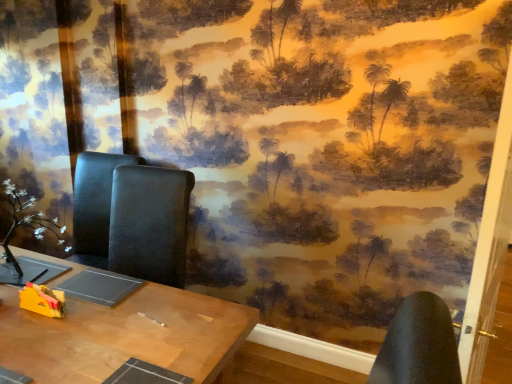
Question: From a real-world perspective, relative to white matte flower at left, is yellow plastic toy at lower left vertically above or below?

Choices:
 (A) below
 (B) above

Answer: (A)

Question: Considering the relative positions of yellow plastic toy at lower left and white matte flower at left in the image provided, is yellow plastic toy at lower left to the left or to the right of white matte flower at left?

Choices:
 (A) left
 (B) right

Answer: (B)

Question: Which of these objects is positioned closest to the wooden table at center?

Choices:
 (A) yellow plastic toy at lower left
 (B) white matte flower at left

Answer: (A)

Question: Based on their relative distances, which object is nearer to the wooden table at center?

Choices:
 (A) white matte flower at left
 (B) yellow plastic toy at lower left

Answer: (B)